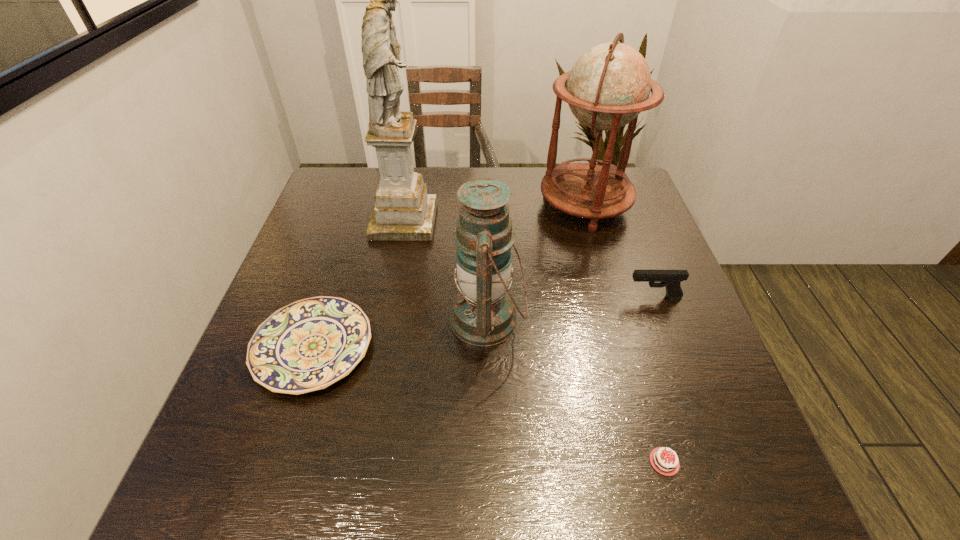
You are a GUI agent. You are given a task and a screenshot of the screen. Output one action in this format:
    pyautogui.click(x=<x>, y=<y>)
    Task: Click on the vacant space situated 0.210m on the surface of the globe
    The width and height of the screenshot is (960, 540).
    Given the screenshot: What is the action you would take?
    pyautogui.click(x=468, y=206)

I want to click on free region located 0.300m on the left of the fourth shortest object, so click(315, 319).

Find the location of a particular element. Image resolution: width=960 pixels, height=540 pixels. vacant position located on the front-facing side of the pistol is located at coordinates (463, 297).

The height and width of the screenshot is (540, 960). I want to click on free location located on the front-facing side of the pistol, so click(565, 297).

Where is `vacant space located 0.180m on the front-facing side of the pistol`? vacant space located 0.180m on the front-facing side of the pistol is located at coordinates (548, 297).

Find the location of a particular element. This screenshot has height=540, width=960. vacant space located on the back of the plate is located at coordinates (334, 285).

At what (x,y) coordinates should I click in order to perform the action: click on vacant space located 0.200m on the left of the chocolate cake. Please return your answer as a coordinate pair (x, y). Looking at the image, I should click on point(511,462).

Image resolution: width=960 pixels, height=540 pixels. What are the coordinates of `sculpture positioned at the far edge` in the screenshot? It's located at (403, 211).

Locate an element on the screen. The height and width of the screenshot is (540, 960). globe located in the far edge section of the desktop is located at coordinates (609, 85).

You are a GUI agent. You are given a task and a screenshot of the screen. Output one action in this format:
    pyautogui.click(x=<x>, y=<y>)
    Task: Click on the object at the near edge
    The image size is (960, 540).
    Given the screenshot: What is the action you would take?
    pyautogui.click(x=660, y=458)